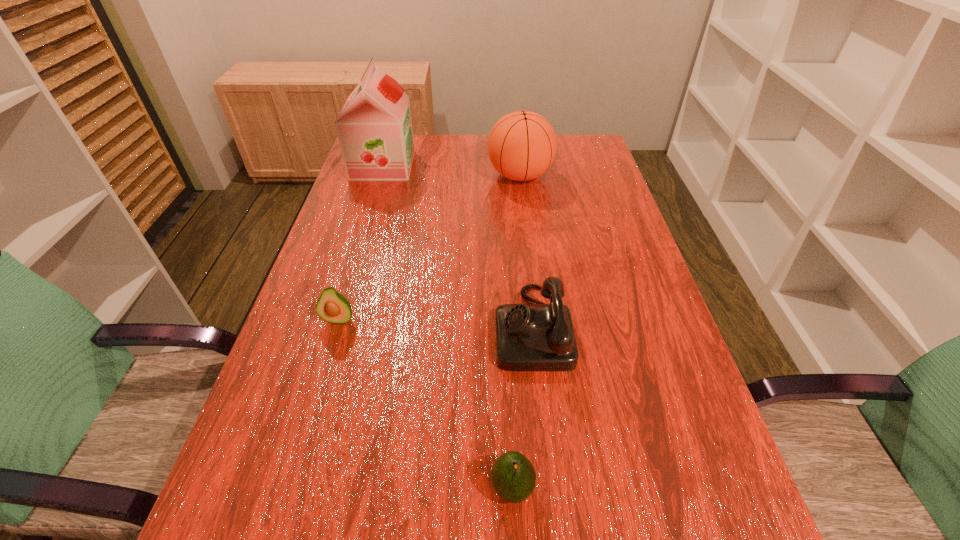
In the image, there is a desktop. Where is `vacant space at the far right corner`? The height and width of the screenshot is (540, 960). vacant space at the far right corner is located at coordinates click(563, 139).

You are a GUI agent. You are given a task and a screenshot of the screen. Output one action in this format:
    pyautogui.click(x=<x>, y=<y>)
    Task: Click on the vacant area that lies between the telephone and the tallest object
    
    Given the screenshot: What is the action you would take?
    pyautogui.click(x=458, y=246)

Find the location of a particular element. This screenshot has height=540, width=960. unoccupied area between the telephone and the tallest object is located at coordinates pos(458,246).

The width and height of the screenshot is (960, 540). Identify the location of unoccupied position between the farther avocado and the soya milk. (361, 242).

Find the location of `vacant region between the telephone and the basketball`. vacant region between the telephone and the basketball is located at coordinates (526, 252).

At what (x,y) coordinates should I click in order to perform the action: click on empty space between the soya milk and the telephone. Please return your answer as a coordinate pair (x, y). Image resolution: width=960 pixels, height=540 pixels. Looking at the image, I should click on (458, 246).

This screenshot has width=960, height=540. In order to click on free spot between the soya milk and the farther avocado in this screenshot , I will do `click(361, 242)`.

Locate an element on the screen. free space between the telephone and the soya milk is located at coordinates (458, 246).

You are a GUI agent. You are given a task and a screenshot of the screen. Output one action in this format:
    pyautogui.click(x=<x>, y=<y>)
    Task: Click on the empty location between the telephone and the nearer avocado
    The width and height of the screenshot is (960, 540).
    Given the screenshot: What is the action you would take?
    pyautogui.click(x=522, y=408)

Identify the location of vacant space that's between the farther avocado and the basketball. (429, 247).